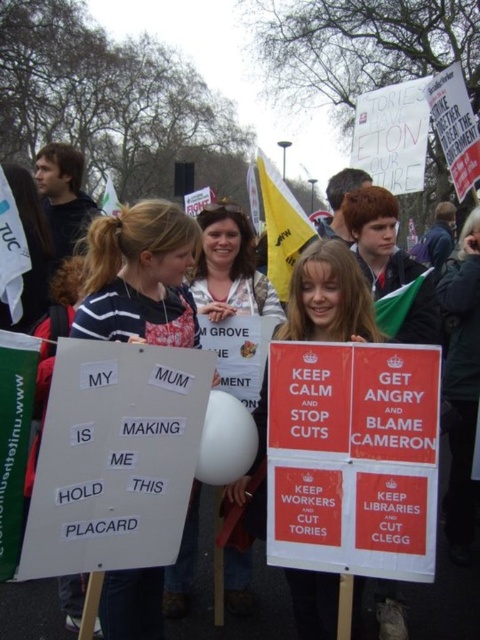
Does matte white sign at center appear on the right side of white paper sign at center?

Correct, you'll find matte white sign at center to the right of white paper sign at center.

Which of these two, matte white sign at center or white paper sign at center, stands shorter?

Standing shorter between the two is matte white sign at center.

Does point (348, 296) come behind point (240, 218)?

That is False.

Locate an element on the screen. This screenshot has height=640, width=480. matte white sign at center is located at coordinates (328, 298).

Does white paper placard at center lie behind white paper sign at center?

That is False.

This screenshot has height=640, width=480. Describe the element at coordinates (140, 276) in the screenshot. I see `white paper placard at center` at that location.

Locate an element on the screen. The height and width of the screenshot is (640, 480). white paper placard at center is located at coordinates (140, 276).

Can you confirm if white paper placard at center is positioned below matte white sign at center?

Incorrect, white paper placard at center is not positioned below matte white sign at center.

Which is below, white paper placard at center or matte white sign at center?

matte white sign at center

Is point (168, 301) closer to camera compared to point (294, 321)?

No, (168, 301) is behind (294, 321).

Locate an element on the screen. Image resolution: width=480 pixels, height=640 pixels. white paper placard at center is located at coordinates (140, 276).